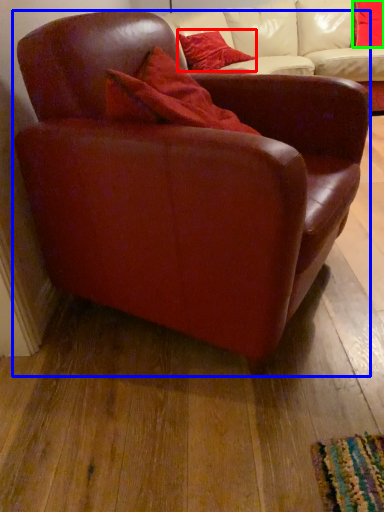
Question: Estimate the real-world distances between objects in this image. Which object is farther from pillow (highlighted by a red box), chair (highlighted by a blue box) or pillow (highlighted by a green box)?

Choices:
 (A) chair
 (B) pillow

Answer: (A)